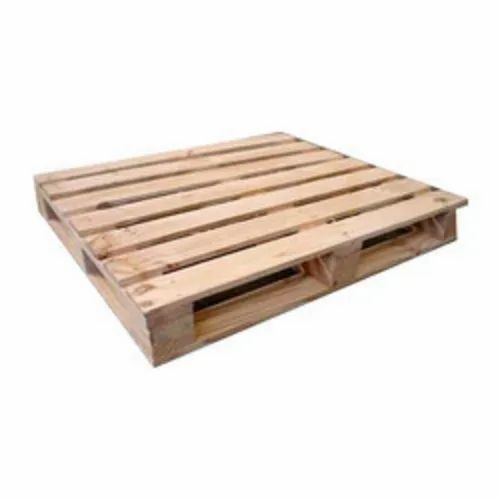
Where is `horizontal slats`? This screenshot has height=500, width=500. horizontal slats is located at coordinates (253, 269), (227, 243), (208, 218), (190, 199), (166, 185), (160, 168), (160, 155), (288, 302).